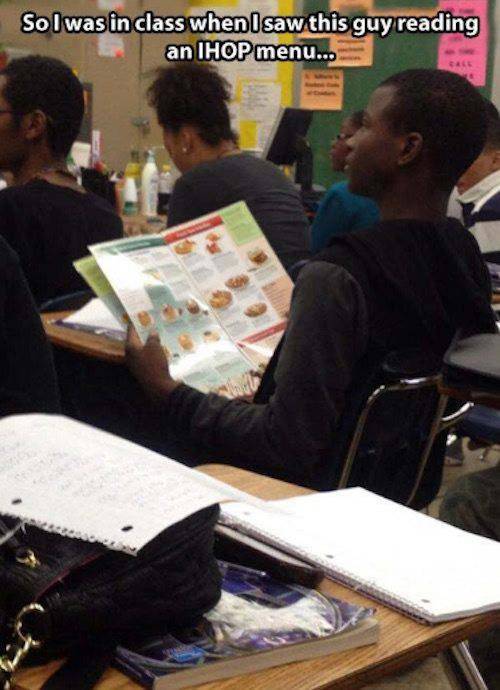
I want to click on 5 students sitting at desks, so click(44, 163), click(202, 159), click(385, 245), click(344, 195), click(487, 237).